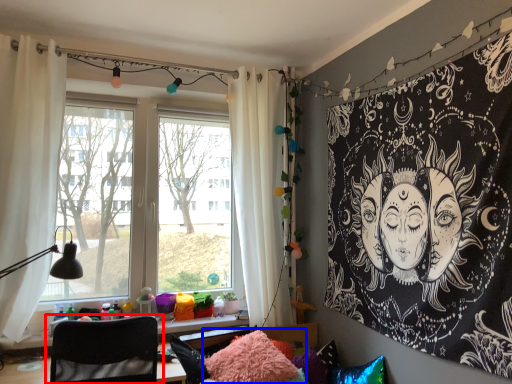
Question: Which object appears farthest to the camera in this image, chair (highlighted by a red box) or pillow (highlighted by a blue box)?

Choices:
 (A) chair
 (B) pillow

Answer: (B)